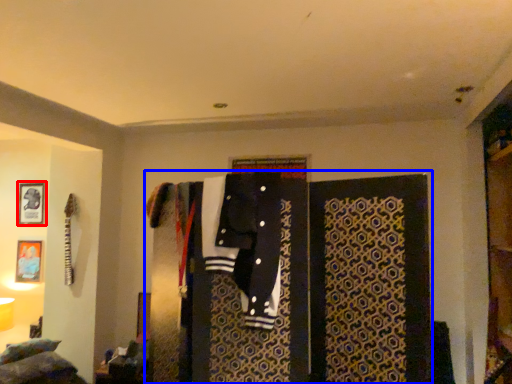
Question: Which object is further to the camera taking this photo, picture frame (highlighted by a red box) or closet (highlighted by a blue box)?

Choices:
 (A) picture frame
 (B) closet

Answer: (A)